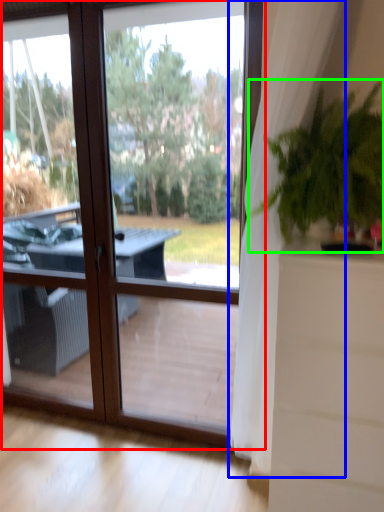
Question: Estimate the real-world distances between objects in this image. Which object is farther from window (highlighted by a red box), curtain (highlighted by a blue box) or houseplant (highlighted by a green box)?

Choices:
 (A) curtain
 (B) houseplant

Answer: (B)